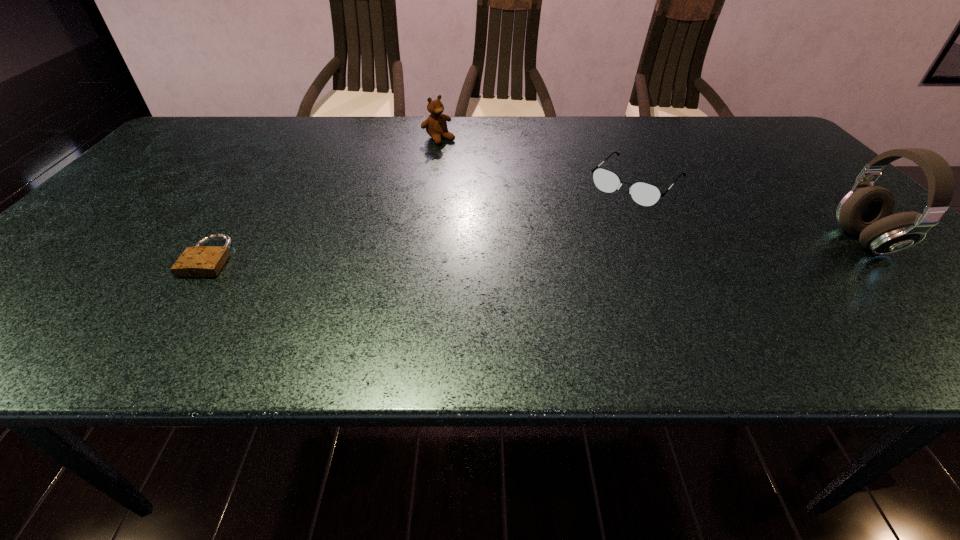
You are a GUI agent. You are given a task and a screenshot of the screen. Output one action in this format:
    pyautogui.click(x=<x>, y=<y>)
    Task: Click on the free space located on the lenses of the second shortest object
    This screenshot has height=540, width=960.
    Given the screenshot: What is the action you would take?
    pyautogui.click(x=569, y=253)

Locate an element on the screen. This screenshot has width=960, height=540. free region located 0.330m at the face of the teddy bear is located at coordinates (516, 195).

Locate an element on the screen. This screenshot has width=960, height=540. vacant area located at the face of the teddy bear is located at coordinates (511, 191).

You are a GUI agent. You are given a task and a screenshot of the screen. Output one action in this format:
    pyautogui.click(x=<x>, y=<y>)
    Task: Click on the blank area located 0.120m at the face of the teddy bear
    The width and height of the screenshot is (960, 540).
    Given the screenshot: What is the action you would take?
    pyautogui.click(x=469, y=161)

Find the location of a particular element. The height and width of the screenshot is (540, 960). object that is at the far edge is located at coordinates (436, 126).

Locate an element on the screen. object at the near edge is located at coordinates (200, 261).

I want to click on object located at the right edge, so [866, 211].

Where is `vacant space at the far edge`? Image resolution: width=960 pixels, height=540 pixels. vacant space at the far edge is located at coordinates (705, 124).

This screenshot has height=540, width=960. I want to click on vacant space at the near edge of the desktop, so (x=154, y=291).

You are a GUI agent. You are given a task and a screenshot of the screen. Output one action in this format:
    pyautogui.click(x=<x>, y=<y>)
    Task: Click on the vacant space at the left edge of the desktop
    
    Given the screenshot: What is the action you would take?
    pyautogui.click(x=76, y=239)